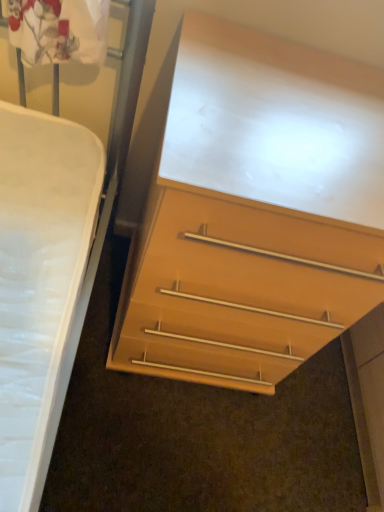
Locate an element on the screen. The width and height of the screenshot is (384, 512). empty space that is to the right of light wood/wooden chest of drawers at center is located at coordinates (308, 430).